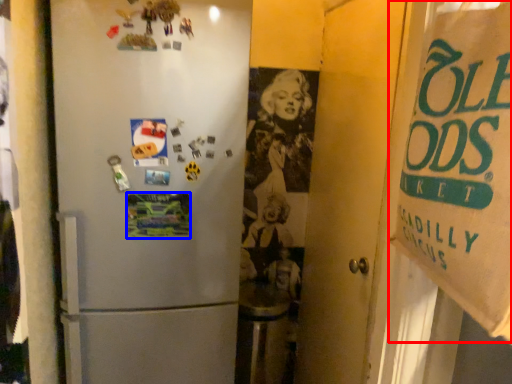
Question: Among these objects, which one is nearest to the camera, poster (highlighted by a red box) or postcard (highlighted by a blue box)?

Choices:
 (A) poster
 (B) postcard

Answer: (A)